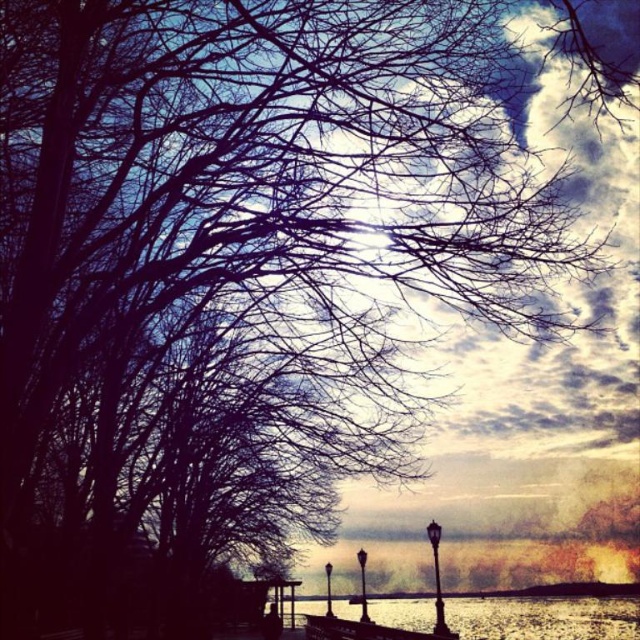
You are standing at the edge of the lakeside and want to walk to the wooden dock at lower center. However, you notice the reflective silver water at lower center between you and the dock. Can you reach the dock without stepping into the water?

The reflective silver water at lower center is larger in size than wooden dock at lower center, so the dock may be surrounded by water. You might need to find another path or ensure the dock is accessible without crossing the larger water area.

You are standing at the edge of the lake and see the reflective silver water at lower center and the wooden dock at lower center. Which object is closer to you?

The reflective silver water at lower center is closer to you because it is further to the viewer than the wooden dock at lower center.